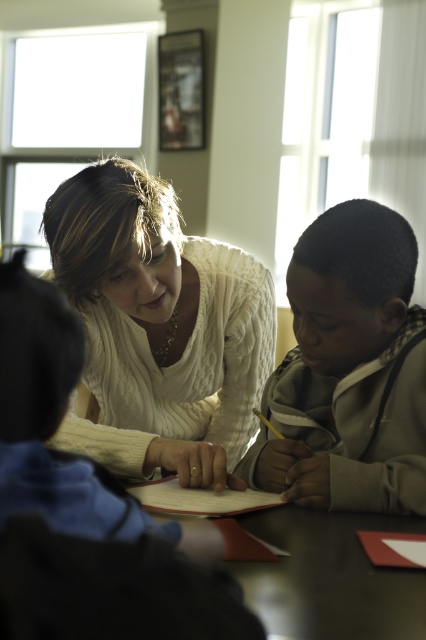
Question: Which object is the farthest from the light brown hoodie at right?

Choices:
 (A) smooth dark wood table at center
 (B) white cable-knit sweater at center

Answer: (B)

Question: Is white cable-knit sweater at center below light brown hoodie at right?

Choices:
 (A) no
 (B) yes

Answer: (A)

Question: Is light brown hoodie at right to the right of smooth dark wood table at center from the viewer's perspective?

Choices:
 (A) yes
 (B) no

Answer: (A)

Question: Does white cable-knit sweater at center lie in front of smooth dark wood table at center?

Choices:
 (A) no
 (B) yes

Answer: (A)

Question: Which of these objects is positioned farthest from the white cable-knit sweater at center?

Choices:
 (A) light brown hoodie at right
 (B) smooth dark wood table at center

Answer: (B)

Question: Among these objects, which one is nearest to the camera?

Choices:
 (A) white cable-knit sweater at center
 (B) light brown hoodie at right
 (C) smooth dark wood table at center

Answer: (C)